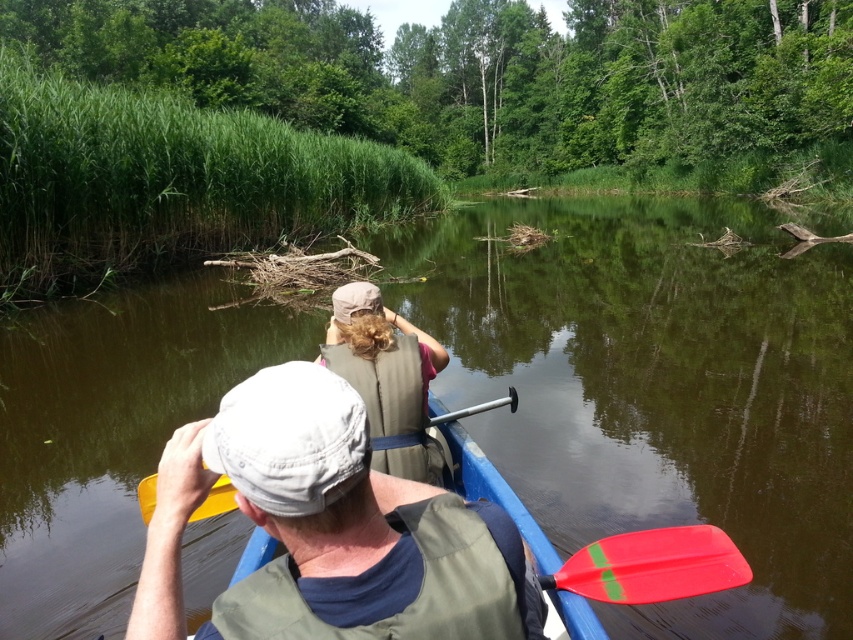
Question: Is matte gray cap at center bigger than red plastic paddle at center?

Choices:
 (A) yes
 (B) no

Answer: (B)

Question: Which point is farther to the camera?

Choices:
 (A) red plastic paddle at center
 (B) beige fabric life vest at center

Answer: (B)

Question: Among these objects, which one is nearest to the camera?

Choices:
 (A) red plastic paddle at center
 (B) matte gray cap at center

Answer: (B)

Question: Is matte gray cap at center thinner than beige fabric life vest at center?

Choices:
 (A) no
 (B) yes

Answer: (A)

Question: Which object appears closest to the camera in this image?

Choices:
 (A) beige fabric life vest at center
 (B) matte gray cap at center

Answer: (B)

Question: Can you confirm if brown murky water at center is smaller than red plastic paddle at center?

Choices:
 (A) yes
 (B) no

Answer: (B)